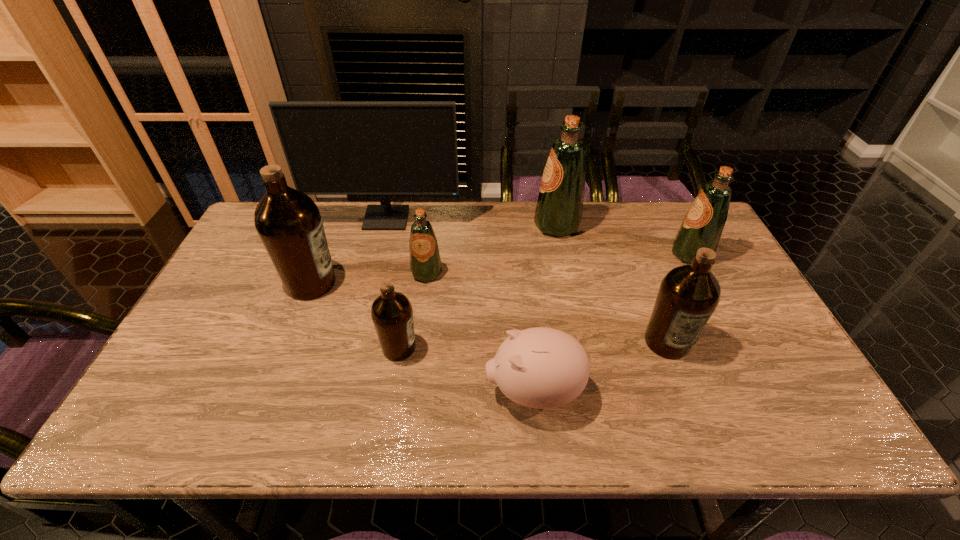
The height and width of the screenshot is (540, 960). What are the coordinates of `unoccupied area between the shortest object and the second brown olive oil from right to left` in the screenshot? It's located at (467, 369).

Image resolution: width=960 pixels, height=540 pixels. I want to click on vacant space that is in between the computer monitor and the smallest green olive oil, so click(x=406, y=246).

The width and height of the screenshot is (960, 540). In order to click on free space between the farthest brown olive oil and the rightmost olive oil in this screenshot , I will do `click(501, 269)`.

What are the coordinates of `object that can be found as the third closest to the smallest green olive oil` in the screenshot? It's located at (288, 222).

Locate an element on the screen. object that can be found as the fifth closest to the piggy bank is located at coordinates (559, 209).

Locate which olive oil ranks sixth in proximity to the shortest object. Please provide its 2D coordinates. Your answer should be formatted as a tuple, i.e. [(x, y)], where the tuple contains the x and y coordinates of a point satisfying the conditions above.

[(702, 227)]

Choose which olive oil is the fourth nearest neighbor to the biggest brown olive oil. Please provide its 2D coordinates. Your answer should be formatted as a tuple, i.e. [(x, y)], where the tuple contains the x and y coordinates of a point satisfying the conditions above.

[(688, 295)]

Locate which green olive oil ranks second in proximity to the rightmost object. Please provide its 2D coordinates. Your answer should be formatted as a tuple, i.e. [(x, y)], where the tuple contains the x and y coordinates of a point satisfying the conditions above.

[(425, 264)]

Identify the location of green olive oil object that ranks as the closest to the piggy bank. This screenshot has height=540, width=960. (425, 264).

The width and height of the screenshot is (960, 540). I want to click on brown olive oil that stands as the second closest to the piggy bank, so click(x=688, y=295).